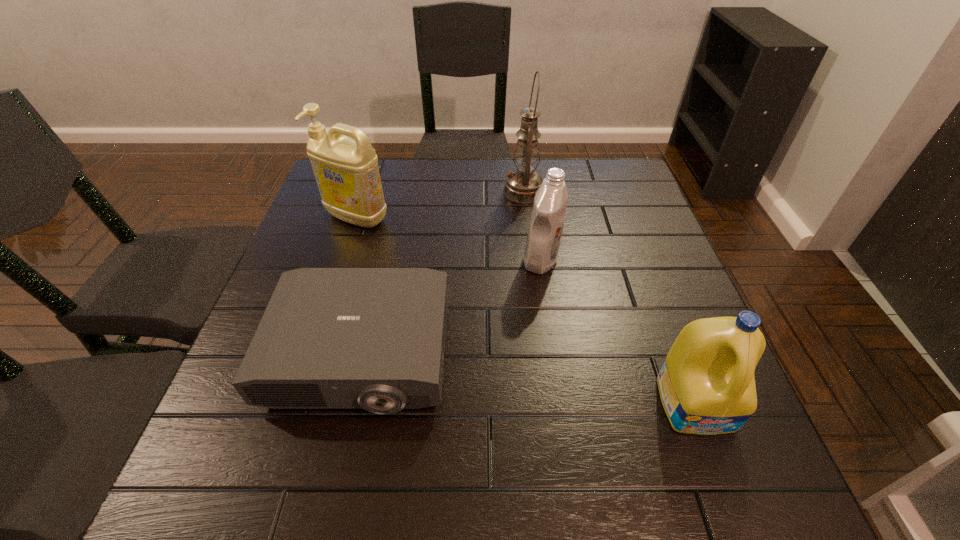
I want to click on oil lamp, so click(521, 185).

The width and height of the screenshot is (960, 540). I want to click on the leftmost detergent, so click(346, 171).

Locate an element on the screen. The image size is (960, 540). the farthest detergent is located at coordinates (346, 171).

You are a GUI agent. You are given a task and a screenshot of the screen. Output one action in this format:
    pyautogui.click(x=<x>, y=<y>)
    Task: Click on the second farthest detergent
    This screenshot has height=540, width=960.
    Given the screenshot: What is the action you would take?
    pyautogui.click(x=547, y=219)

What are the coordinates of `the second detergent from right to left` in the screenshot? It's located at (547, 219).

Where is `the rightmost detergent`? The height and width of the screenshot is (540, 960). the rightmost detergent is located at coordinates (706, 384).

You are a GUI agent. You are given a task and a screenshot of the screen. Output one action in this format:
    pyautogui.click(x=<x>, y=<y>)
    Task: Click on the rightmost object
    Image resolution: width=960 pixels, height=540 pixels.
    Given the screenshot: What is the action you would take?
    pyautogui.click(x=706, y=384)

The image size is (960, 540). I want to click on projector, so click(x=330, y=338).

At what (x,y) coordinates should I click in order to perform the action: click on free spot located 0.170m on the right of the oil lamp. Please return your answer as a coordinate pair (x, y). This screenshot has width=960, height=540. Looking at the image, I should click on (604, 191).

Where is `vacant space located on the front of the tallest detergent`? The width and height of the screenshot is (960, 540). vacant space located on the front of the tallest detergent is located at coordinates (321, 329).